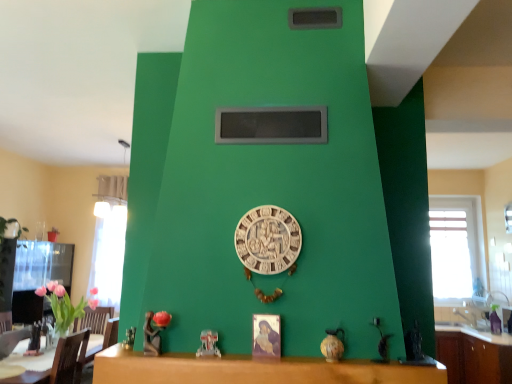
Describe the element at coordinates (456, 247) in the screenshot. I see `transparent glass window at right, which is the 2th window from left to right` at that location.

In order to face black matte window screen at upper center, should I rotate leftwards or rightwards?

Rotate right and turn 2.399 degrees.

Describe the element at coordinates (12, 340) in the screenshot. I see `brown leather armchair at lower left` at that location.

Where is `white glass window at left, placed as the second window when sorted from right to left`? white glass window at left, placed as the second window when sorted from right to left is located at coordinates (108, 253).

Is point (3, 357) positioned behind point (456, 202)?

That is False.

Is brown leather armchair at lower left looking in the opposite direction of transparent glass window at right, acting as the 1th window starting from the right?

A: Yes.

Considering the positions of objects brown leather armchair at lower left and transparent glass window at right, which is the 2th window from left to right, in the image provided, who is in front, brown leather armchair at lower left or transparent glass window at right, which is the 2th window from left to right,?

brown leather armchair at lower left.

How distant is brown leather armchair at lower left from transparent glass window at right, acting as the 1th window starting from the right?

brown leather armchair at lower left is 5.07 meters from transparent glass window at right, acting as the 1th window starting from the right.

At what (x,y) coordinates should I click in order to perform the action: click on window on the right side of white carved clock at center. Please return your answer as a coordinate pair (x, y). Looking at the image, I should click on (456, 247).

From a real-world perspective, is white carved clock at center positioned over transparent glass window at right, acting as the 1th window starting from the right, based on gravity?

No, from a real-world perspective, white carved clock at center is not above transparent glass window at right, acting as the 1th window starting from the right.

How distant is white carved clock at center from transparent glass window at right, which is the 2th window from left to right?

white carved clock at center and transparent glass window at right, which is the 2th window from left to right, are 4.68 meters apart from each other.

Does white carved clock at center have a larger size compared to transparent glass window at right, acting as the 1th window starting from the right?

No.

Does white glass window at left, placed as the second window when sorted from right to left, contain brown wood cabinet at lower right?

No.

Does white glass window at left, placed as the second window when sorted from right to left, have a smaller size compared to brown wood cabinet at lower right?

Correct, white glass window at left, placed as the second window when sorted from right to left, occupies less space than brown wood cabinet at lower right.

Considering the relative positions of white glass window at left, arranged as the first window when viewed from the left, and brown wood cabinet at lower right in the image provided, is white glass window at left, arranged as the first window when viewed from the left, to the left of brown wood cabinet at lower right from the viewer's perspective?

Correct, you'll find white glass window at left, arranged as the first window when viewed from the left, to the left of brown wood cabinet at lower right.

Does white glass window at left, placed as the second window when sorted from right to left, come in front of brown wood cabinet at lower right?

No, it is behind brown wood cabinet at lower right.

Consider the image. Is wooden table at center at the back of black matte window screen at upper center?

No.

In the scene shown: Does black matte window screen at upper center have a smaller size compared to wooden table at center?

Yes.

How many degrees apart are the facing directions of black matte window screen at upper center and wooden table at center?

They differ by 0.215 degrees in their facing directions.

Can we say black matte window screen at upper center lies outside wooden table at center?

Yes.

Can we say white carved clock at center lies outside wooden table at center?

Absolutely, white carved clock at center is external to wooden table at center.

Is white carved clock at center oriented away from wooden table at center?

No.

Considering the relative sizes of white carved clock at center and wooden table at center in the image provided, is white carved clock at center thinner than wooden table at center?

Correct, the width of white carved clock at center is less than that of wooden table at center.

Does point (293, 219) come farther from viewer compared to point (127, 364)?

Yes, it is.

In the scene shown: Does white carved clock at center have a lesser height compared to black matte window screen at upper center?

In fact, white carved clock at center may be taller than black matte window screen at upper center.

From the image's perspective, relative to black matte window screen at upper center, is white carved clock at center above or below?

From the image's perspective, white carved clock at center appears below black matte window screen at upper center.

From a real-world perspective, which is physically below, white carved clock at center or black matte window screen at upper center?

white carved clock at center.

Is point (269, 270) farther from camera compared to point (254, 122)?

No, it is in front of (254, 122).

Is brown wood cabinet at lower right next to white carved clock at center?

brown wood cabinet at lower right is not next to white carved clock at center, and they're not touching.

Which is behind, point (446, 335) or point (277, 249)?

The point (446, 335) is farther from the camera.

Considering the relative sizes of brown wood cabinet at lower right and white carved clock at center in the image provided, is brown wood cabinet at lower right taller than white carved clock at center?

Yes.

Which of these two, brown wood cabinet at lower right or white carved clock at center, is bigger?

With larger size is brown wood cabinet at lower right.

Identify the location of window on the right of brown leather armchair at lower left. This screenshot has height=384, width=512. (456, 247).

Locate an element on the screen. The height and width of the screenshot is (384, 512). clock on the left of transparent glass window at right, which is the 2th window from left to right is located at coordinates 268,240.

When comparing their distances from brown wood cabinet at lower right, does black matte window screen at upper center or wooden table at center seem closer?

wooden table at center lies closer to brown wood cabinet at lower right than the other object.

Estimate the real-world distances between objects in this image. Which object is closer to brown wood cabinet at lower right, white carved clock at center or black matte window screen at upper center?

Among the two, white carved clock at center is located nearer to brown wood cabinet at lower right.

Which object lies nearer to the anchor point brown leather armchair at lower left, white carved clock at center or transparent glass window at right, acting as the 1th window starting from the right?

Result: white carved clock at center is positioned closer to the anchor brown leather armchair at lower left.

Looking at this image, from the image, which object appears to be nearer to black matte window screen at upper center, brown wood cabinet at lower right or wooden table at center?

Among the two, wooden table at center is located nearer to black matte window screen at upper center.

Based on their spatial positions, is brown leather armchair at lower left or transparent glass window at right, acting as the 1th window starting from the right, further from brown wood cabinet at lower right?

brown leather armchair at lower left lies further to brown wood cabinet at lower right than the other object.

Estimate the real-world distances between objects in this image. Which object is closer to wooden table at center, white glass window at left, arranged as the first window when viewed from the left, or brown wood cabinet at lower right?

The object closer to wooden table at center is brown wood cabinet at lower right.

Looking at the image, which one is located closer to brown leather armchair at lower left, wooden table at center or transparent glass window at right, which is the 2th window from left to right?

The object closer to brown leather armchair at lower left is wooden table at center.

Considering their positions, is white carved clock at center positioned closer to white glass window at left, placed as the second window when sorted from right to left, than transparent glass window at right, acting as the 1th window starting from the right?

white carved clock at center lies closer to white glass window at left, placed as the second window when sorted from right to left, than the other object.

Find the location of `window screen positioned between white carved clock at center and transparent glass window at right, which is the 2th window from left to right, from near to far`. window screen positioned between white carved clock at center and transparent glass window at right, which is the 2th window from left to right, from near to far is located at coordinates (271, 125).

Where is `cabinetry positioned between wooden table at center and transparent glass window at right, which is the 2th window from left to right, from near to far`? This screenshot has width=512, height=384. cabinetry positioned between wooden table at center and transparent glass window at right, which is the 2th window from left to right, from near to far is located at coordinates (473, 356).

The image size is (512, 384). Find the location of `clock located between brown leather armchair at lower left and brown wood cabinet at lower right in the left-right direction`. clock located between brown leather armchair at lower left and brown wood cabinet at lower right in the left-right direction is located at coordinates (268, 240).

I want to click on window screen between white carved clock at center and brown wood cabinet at lower right in the horizontal direction, so [271, 125].